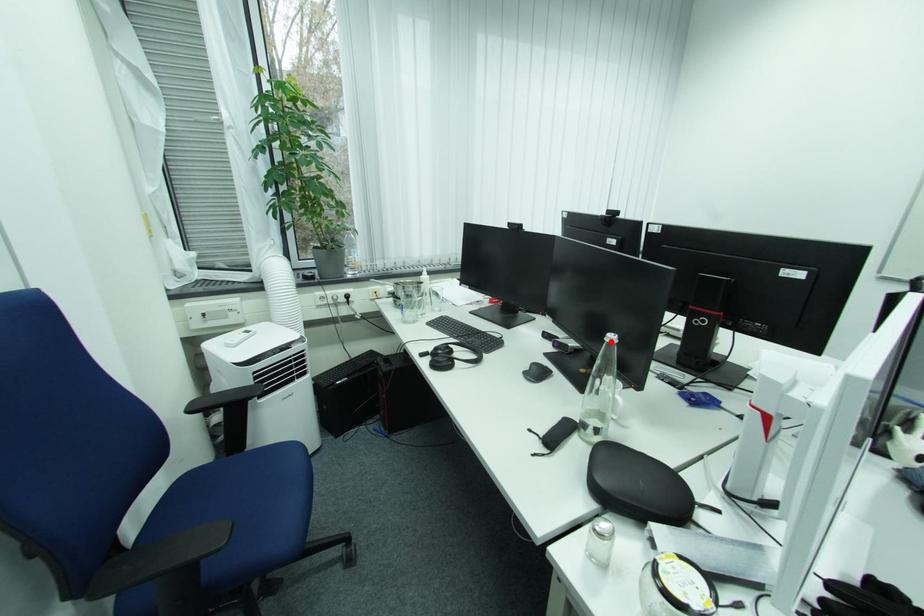
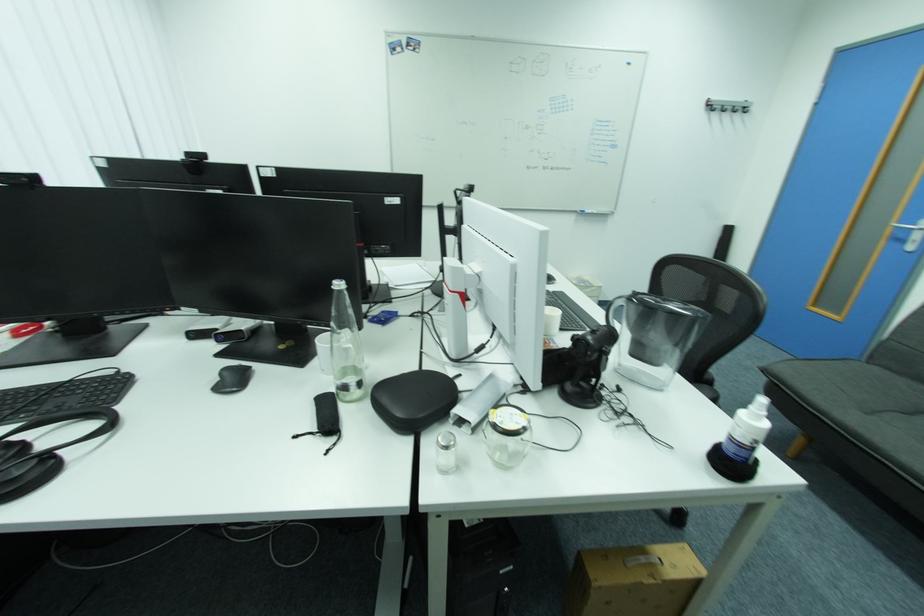
Where in the second image is the point corresponding to the highlighted location from the first image?

(339, 292)